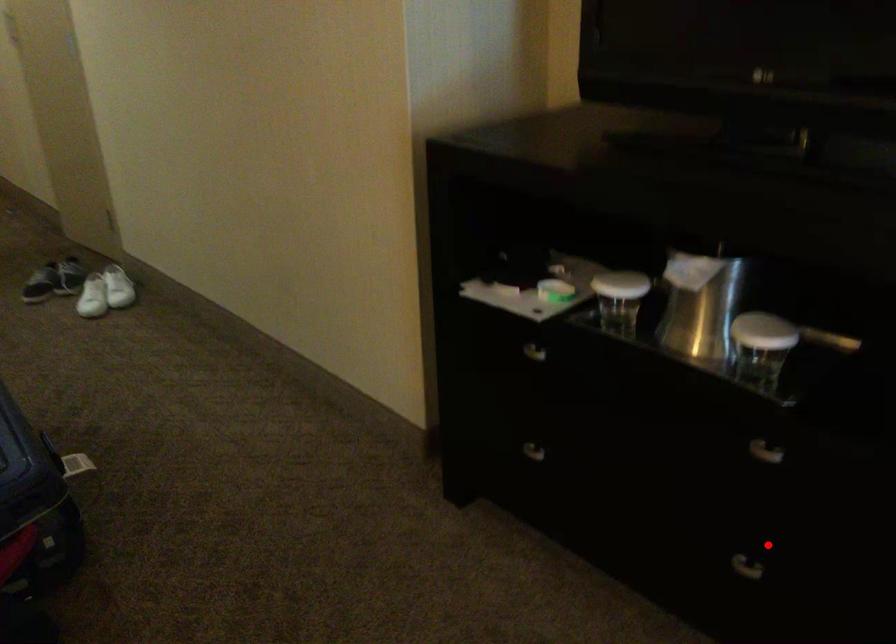
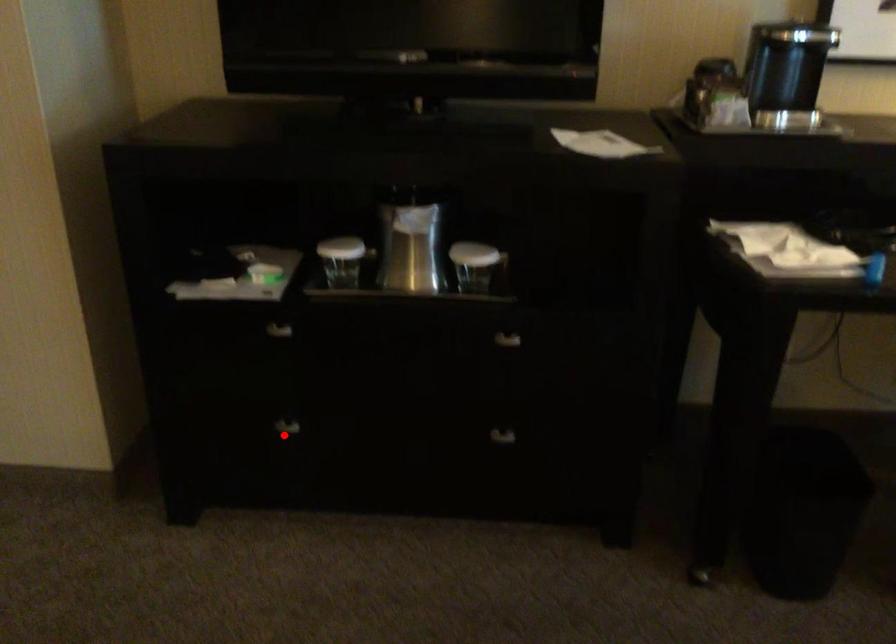
I am providing you with two images of the same scene from different viewpoints. A red point is marked on the first image and another point is marked on the second image. Do the highlighted points in image1 and image2 indicate the same real-world spot?

No